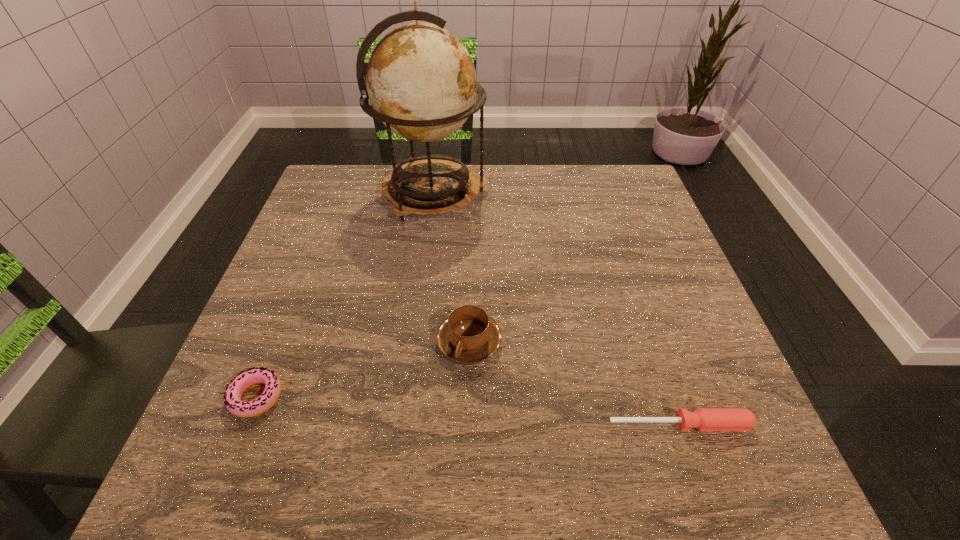
At what (x,y) coordinates should I click in order to perform the action: click on the tallest object. Please return your answer as a coordinate pair (x, y). Looking at the image, I should click on (421, 81).

You are a GUI agent. You are given a task and a screenshot of the screen. Output one action in this format:
    pyautogui.click(x=<x>, y=<y>)
    Task: Click on the globe
    The width and height of the screenshot is (960, 540).
    Given the screenshot: What is the action you would take?
    pyautogui.click(x=421, y=81)

What are the coordinates of `cappuccino` in the screenshot? It's located at (468, 335).

The image size is (960, 540). In order to click on the second tallest object in this screenshot , I will do `click(468, 335)`.

Identify the location of screwdriver. (704, 419).

You are a GUI agent. You are given a task and a screenshot of the screen. Output one action in this format:
    pyautogui.click(x=<x>, y=<y>)
    Task: Click on the doughnut
    
    Given the screenshot: What is the action you would take?
    pyautogui.click(x=232, y=397)

Where is `free space located at the center of the tallest object`? This screenshot has width=960, height=540. free space located at the center of the tallest object is located at coordinates 639,194.

I want to click on vacant space located 0.180m on the side of the third shortest object with the handle, so click(467, 472).

The width and height of the screenshot is (960, 540). Find the location of `free space located 0.300m on the left of the rightmost object`. free space located 0.300m on the left of the rightmost object is located at coordinates (423, 424).

Find the location of `vacant position located on the right of the leftmost object`. vacant position located on the right of the leftmost object is located at coordinates (399, 397).